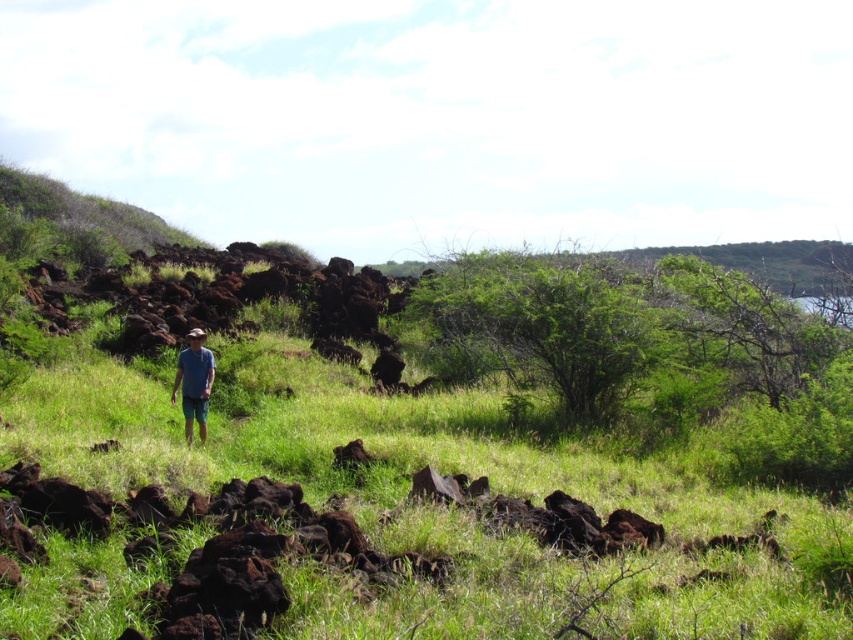
Question: Which of the following is the farthest from the observer?

Choices:
 (A) blue fabric shirt at center
 (B) brown rough rocks at center

Answer: (A)

Question: Which object is closer to the camera taking this photo?

Choices:
 (A) blue fabric shirt at center
 (B) brown rough rocks at center

Answer: (B)

Question: Is brown rough rocks at center below blue fabric shirt at center?

Choices:
 (A) no
 (B) yes

Answer: (B)

Question: Which object appears closest to the camera in this image?

Choices:
 (A) brown rough rocks at center
 (B) blue fabric shirt at center

Answer: (A)

Question: Where is brown rough rocks at center located in relation to blue fabric shirt at center in the image?

Choices:
 (A) left
 (B) right

Answer: (B)

Question: Can you confirm if brown rough rocks at center is bigger than blue fabric shirt at center?

Choices:
 (A) yes
 (B) no

Answer: (A)